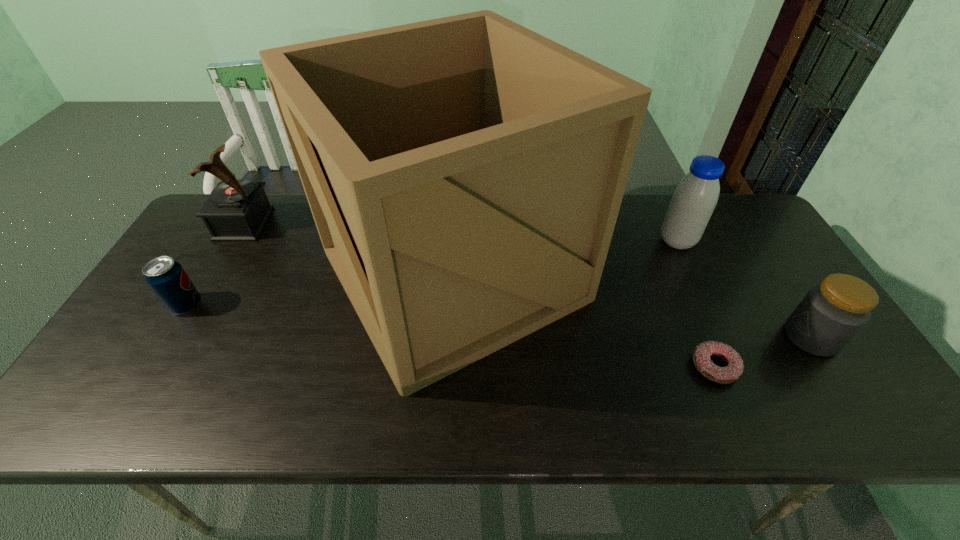
At what (x,y) coordinates should I click in order to perform the action: click on vacant area between the rightmost object and the third object from left to right. Please return your answer as a coordinate pair (x, y). The height and width of the screenshot is (540, 960). Looking at the image, I should click on pos(632,306).

Locate an element on the screen. The image size is (960, 540). vacant area that lies between the doughnut and the fourth object from right to left is located at coordinates (584, 320).

Find the location of a particular element. This screenshot has height=540, width=960. empty space that is in between the soda can and the box is located at coordinates tap(320, 289).

Where is `the third closest object relative to the phonograph_record`? the third closest object relative to the phonograph_record is located at coordinates (695, 197).

Select which object is the closest to the doughnut. Please provide its 2D coordinates. Your answer should be formatted as a tuple, i.e. [(x, y)], where the tuple contains the x and y coordinates of a point satisfying the conditions above.

[(831, 314)]

Where is `free location that satisfies the following two spatial constraints: 1. at the horn opening of the shortest object; 2. on the right side of the phonograph_record`? Image resolution: width=960 pixels, height=540 pixels. free location that satisfies the following two spatial constraints: 1. at the horn opening of the shortest object; 2. on the right side of the phonograph_record is located at coordinates tap(161, 366).

The image size is (960, 540). In order to click on free space that satisfies the following two spatial constraints: 1. at the horn opening of the soya milk; 2. on the right side of the phonograph_record in this screenshot , I will do coord(234,241).